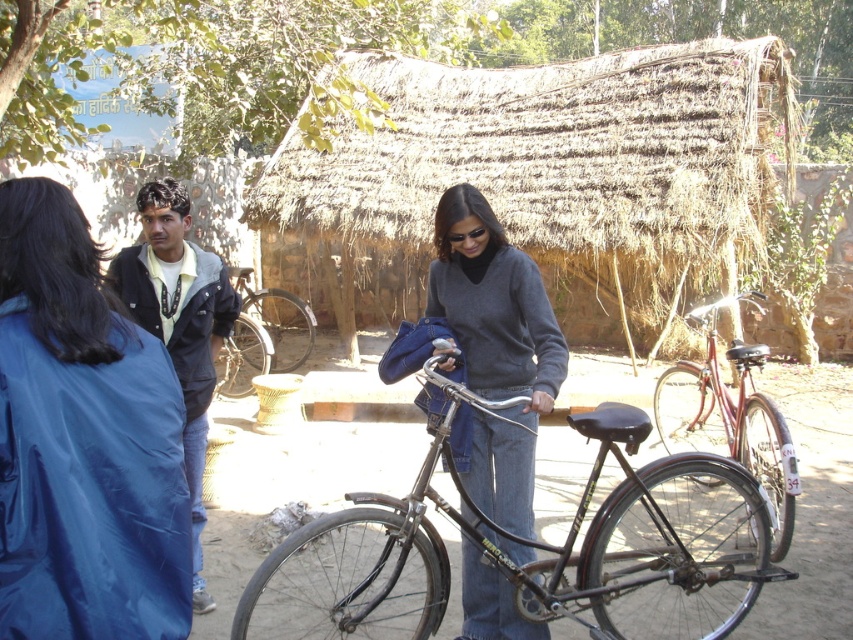
Question: Does shiny metallic bicycle at center appear over silver metallic bicycle at center?

Choices:
 (A) yes
 (B) no

Answer: (B)

Question: Which object appears farthest from the camera in this image?

Choices:
 (A) dark gray sweater at center
 (B) black matte bicycle at center

Answer: (A)

Question: Among these objects, which one is nearest to the camera?

Choices:
 (A) thatched straw hut at center
 (B) silver metallic bicycle at center

Answer: (A)

Question: Among these points, which one is farthest from the camera?

Choices:
 (A) (160, 317)
 (B) (131, 323)

Answer: (A)

Question: Does thatched straw hut at center appear under black plastic goggles at center?

Choices:
 (A) no
 (B) yes

Answer: (A)

Question: Is shiny metallic bicycle at center thinner than black plastic goggles at center?

Choices:
 (A) yes
 (B) no

Answer: (B)